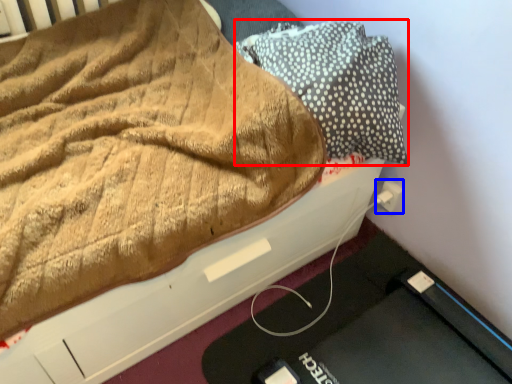
Question: Which object appears farthest to the camera in this image, pillow (highlighted by a red box) or electric outlet (highlighted by a blue box)?

Choices:
 (A) pillow
 (B) electric outlet

Answer: (B)